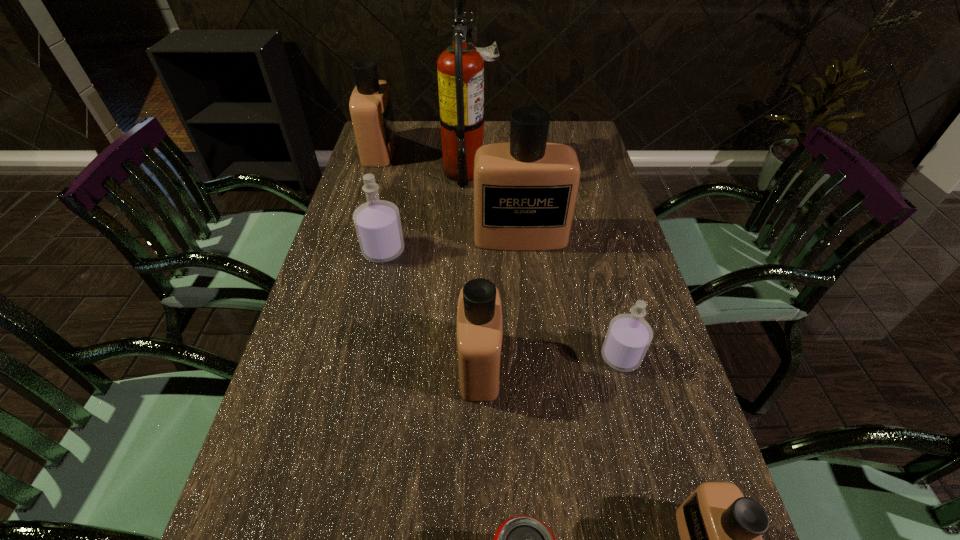
Identify which perfume is the fifth nearest to the red fire extinguisher. Please provide its 2D coordinates. Your answer should be formatted as a tuple, i.e. [(x, y)], where the tuple contains the x and y coordinates of a point satisfying the conditions above.

[(628, 337)]

Point out which perfume is positioned as the fourth nearest to the shortest object. Please provide its 2D coordinates. Your answer should be formatted as a tuple, i.e. [(x, y)], where the tuple contains the x and y coordinates of a point satisfying the conditions above.

[(377, 222)]

Find the location of a particular element. The image size is (960, 540). the second closest beige perfume relative to the red fire extinguisher is located at coordinates (370, 106).

What are the coordinates of `beige perfume object that ranks as the second closest to the smallest beige perfume` in the screenshot? It's located at (525, 190).

The height and width of the screenshot is (540, 960). I want to click on free point that satisfies the following two spatial constraints: 1. on the front label of the tallest perfume; 2. on the front label of the third biggest beige perfume, so click(533, 365).

Find the location of a particular element. The width and height of the screenshot is (960, 540). free spot that satisfies the following two spatial constraints: 1. on the front label of the third smallest beige perfume; 2. on the left side of the right purple perfume is located at coordinates (317, 357).

Locate an element on the screen. The height and width of the screenshot is (540, 960). vacant space that satisfies the following two spatial constraints: 1. on the front label of the leftmost beige perfume; 2. on the left side of the nearer purple perfume is located at coordinates (317, 357).

Locate an element on the screen. free region that satisfies the following two spatial constraints: 1. on the front label of the right purple perfume; 2. on the left side of the second biggest beige perfume is located at coordinates (317, 357).